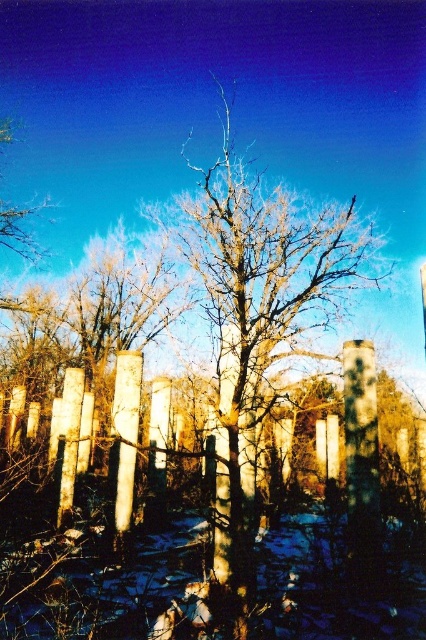
You are standing in the winter scene and want to take a photo of both the bare wood tree at center and the wooden post at center. Which object should you focus on first to ensure both are in the frame?

You should focus on the bare wood tree at center first because it is closer to the viewer than the wooden post at center, ensuring both are in the frame.

You are standing in the winter scene and want to walk from the wooden post at center to the white smooth pillar at center. Which direction should you face to move directly towards it?

You should face to the right to move directly towards the white smooth pillar at center from the wooden post at center since the white smooth pillar at center is located to the right of the wooden post at center.

You are standing at the edge of the snowy field and want to walk directly to the wooden post at center. However, there is a bare wood tree at center blocking your path. Can you walk around the tree to reach the post without going off the snowy field?

The bare wood tree at center is 11.08 meters away from the wooden post at center. Since the tree is blocking the direct path, you can walk around it either to the left or right side to reach the post while staying on the snowy field.